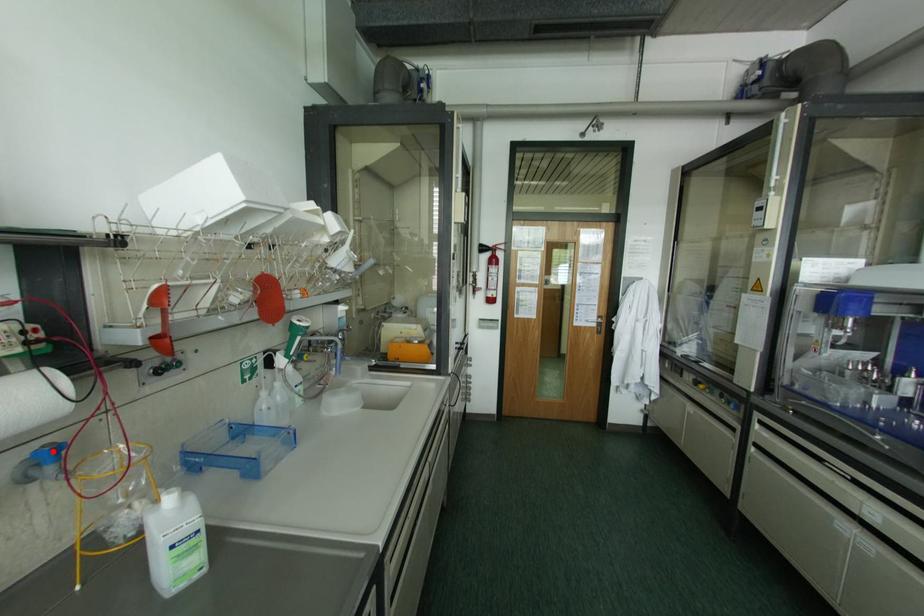
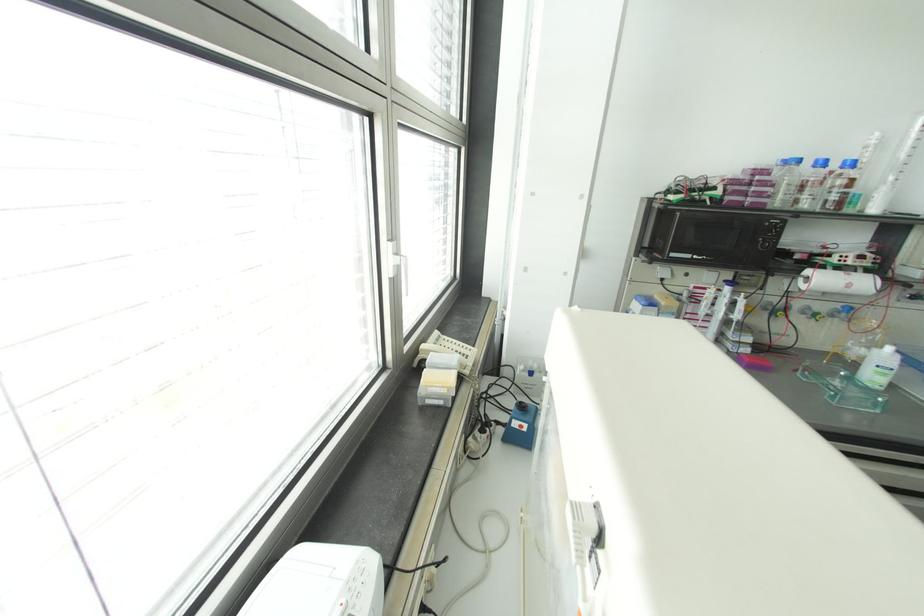
Find the pixel in the second image that matches the highlighted location in the first image.

(848, 309)